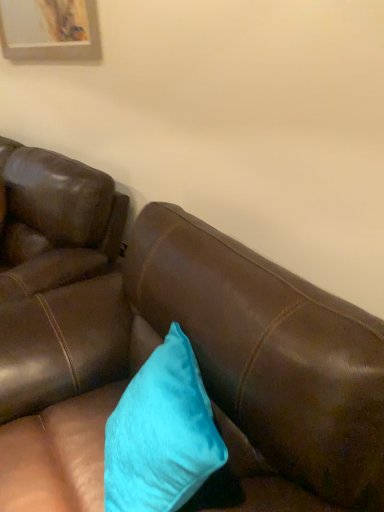
Question: Could you tell me if turquoise velvet pillow at center is facing brown leather couch at center?

Choices:
 (A) yes
 (B) no

Answer: (A)

Question: Is turquoise velvet pillow at center oriented away from brown leather couch at center?

Choices:
 (A) yes
 (B) no

Answer: (A)

Question: Is turquoise velvet pillow at center completely or partially outside of brown leather couch at center?

Choices:
 (A) yes
 (B) no

Answer: (B)

Question: From the image's perspective, would you say turquoise velvet pillow at center is positioned over brown leather couch at center?

Choices:
 (A) no
 (B) yes

Answer: (B)

Question: Does turquoise velvet pillow at center lie behind brown leather couch at center?

Choices:
 (A) yes
 (B) no

Answer: (A)

Question: From a real-world perspective, is turquoise velvet pillow at center physically above brown leather couch at center?

Choices:
 (A) no
 (B) yes

Answer: (B)

Question: Would you say brown leather couch at center contains turquoise velvet pillow at center?

Choices:
 (A) no
 (B) yes

Answer: (B)

Question: Can you confirm if brown leather couch at center is smaller than turquoise velvet pillow at center?

Choices:
 (A) no
 (B) yes

Answer: (A)

Question: Considering the relative positions of brown leather couch at center and turquoise velvet pillow at center in the image provided, is brown leather couch at center to the right of turquoise velvet pillow at center from the viewer's perspective?

Choices:
 (A) yes
 (B) no

Answer: (B)

Question: Is brown leather couch at center not close to turquoise velvet pillow at center?

Choices:
 (A) no
 (B) yes

Answer: (A)

Question: Is brown leather couch at center outside of turquoise velvet pillow at center?

Choices:
 (A) no
 (B) yes

Answer: (B)

Question: From a real-world perspective, is brown leather couch at center on turquoise velvet pillow at center?

Choices:
 (A) yes
 (B) no

Answer: (B)

Question: Does point (193, 421) appear closer or farther from the camera than point (344, 444)?

Choices:
 (A) closer
 (B) farther

Answer: (B)